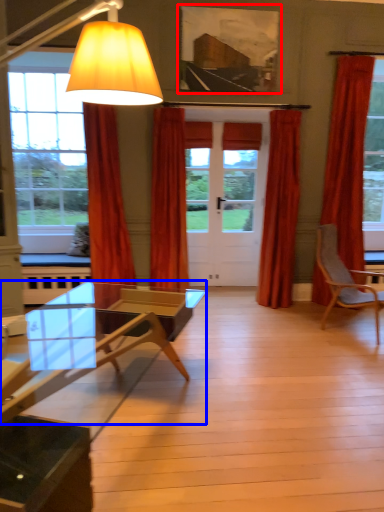
Question: Which object is closer to the camera taking this photo, picture frame (highlighted by a red box) or coffee table (highlighted by a blue box)?

Choices:
 (A) picture frame
 (B) coffee table

Answer: (B)